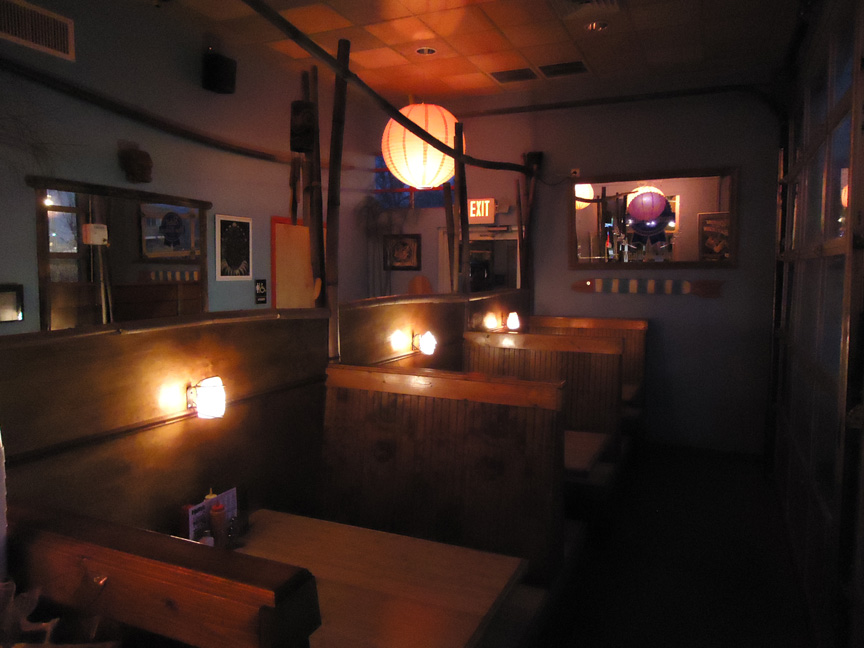
Locate an element on the screen. window is located at coordinates (67, 236).